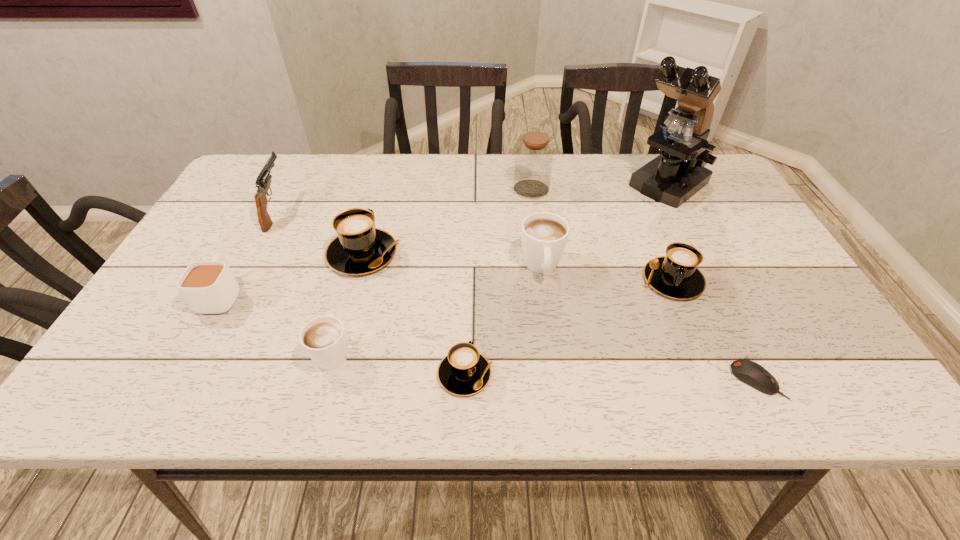
The width and height of the screenshot is (960, 540). I want to click on the tallest object, so click(679, 172).

Locate an element on the screen. The width and height of the screenshot is (960, 540). jar is located at coordinates (534, 157).

What are the coordinates of `brown jar` in the screenshot? It's located at (534, 157).

Identify the location of gun. Image resolution: width=960 pixels, height=540 pixels. (263, 181).

Where is `the right white cappuccino`? Image resolution: width=960 pixels, height=540 pixels. the right white cappuccino is located at coordinates (544, 235).

The width and height of the screenshot is (960, 540). I want to click on the fourth cappuccino from left to right, so click(544, 235).

In order to click on the biggest black cappuccino in this screenshot , I will do `click(360, 248)`.

You are a GUI agent. You are given a task and a screenshot of the screen. Output one action in this format:
    pyautogui.click(x=<x>, y=<y>)
    Task: Click on the white cup
    
    Given the screenshot: What is the action you would take?
    [209, 287]

Identify the location of the rightmost black cappuccino. (676, 275).

The width and height of the screenshot is (960, 540). I want to click on the rightmost cappuccino, so click(676, 275).